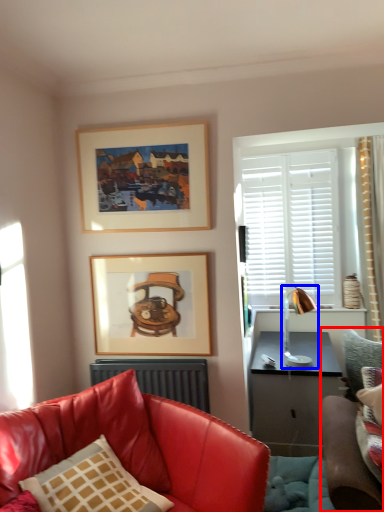
Question: Among these objects, which one is farthest to the camera, studio couch (highlighted by a red box) or lamp (highlighted by a blue box)?

Choices:
 (A) studio couch
 (B) lamp

Answer: (B)